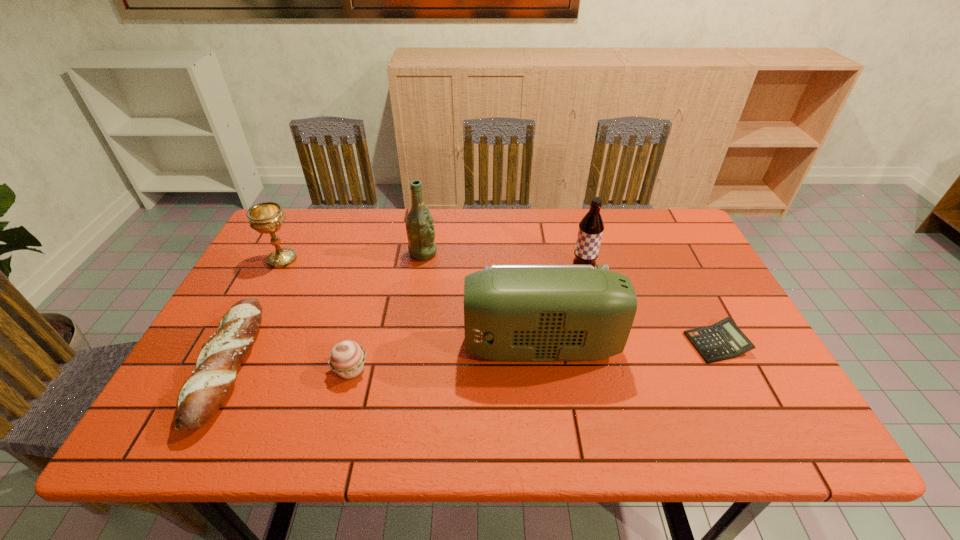
The height and width of the screenshot is (540, 960). I want to click on vacant space at the far left corner of the desktop, so click(x=261, y=252).

Locate an element on the screen. This screenshot has width=960, height=540. vacant space at the near left corner of the desktop is located at coordinates (180, 437).

At what (x,y) coordinates should I click in order to perform the action: click on unoccupied area between the sixth tallest object and the root beer. Please return your answer as a coordinate pair (x, y). Looking at the image, I should click on (406, 319).

Where is `vacant space that's between the fourth shortest object and the cupcake`? vacant space that's between the fourth shortest object and the cupcake is located at coordinates (317, 314).

This screenshot has height=540, width=960. What are the coordinates of `vacant area that lies between the fifth object from right to left and the fourth object from left to right` in the screenshot? It's located at (387, 311).

At what (x,y) coordinates should I click in order to perform the action: click on vacant region between the third object from left to right and the chalice. Please return your answer as a coordinate pair (x, y). Looking at the image, I should click on (317, 314).

Find the location of `free space that is in between the chalice and the fourth object from left to right`. free space that is in between the chalice and the fourth object from left to right is located at coordinates (352, 256).

Identify which object is located as the fifth nearest to the chalice. Please provide its 2D coordinates. Your answer should be formatted as a tuple, i.e. [(x, y)], where the tuple contains the x and y coordinates of a point satisfying the conditions above.

[(591, 227)]

The image size is (960, 540). I want to click on object that stands as the sixth closest to the beer bottle, so click(723, 340).

The height and width of the screenshot is (540, 960). I want to click on free space that satisfies the following two spatial constraints: 1. on the front side of the second shortest object; 2. on the left side of the chalice, so click(x=227, y=366).